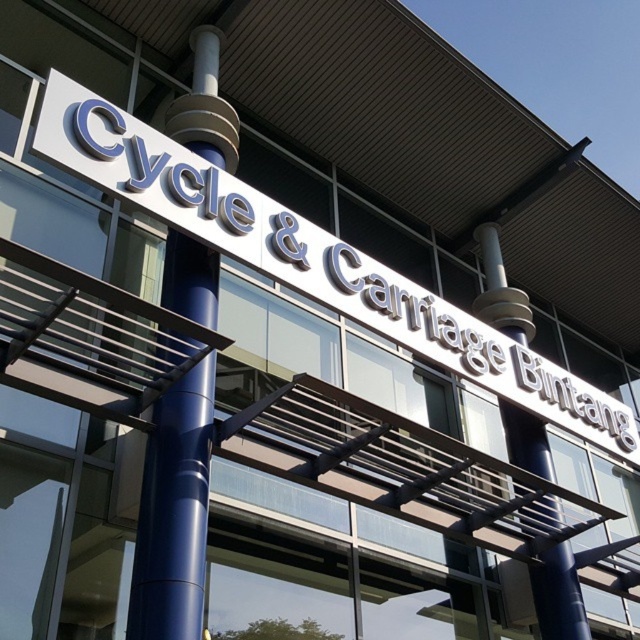
You are a delivery person arriving at the Cycle and Carriage Bintang building. You need to park your vehicle between the two blue polished metal pole at center and the white glossy sign at upper center. Is there enough space between them to park your vehicle?

The white glossy sign at upper center is larger in size than the blue polished metal pole at center, but the description does not provide specific measurements of the distance between them. Therefore, it is unclear if there is enough space to park between them.

You are a window cleaner with a ladder that can reach up to 3 meters. You need to clean the white glossy sign at upper center and the blue polished metal pole at center. Based on their heights, which object will require the ladder to be fully extended to reach?

The white glossy sign at upper center requires the ladder to be fully extended because it has a greater height compared to the blue polished metal pole at center.